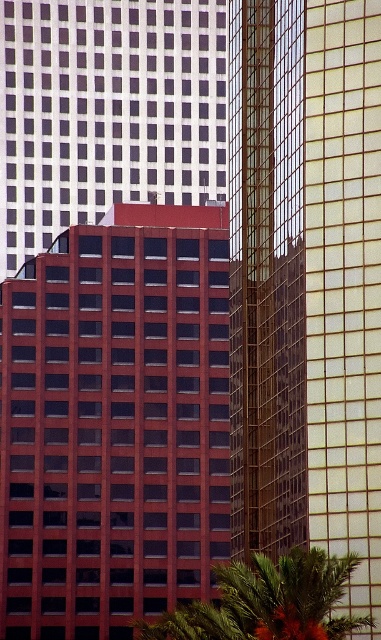
You are standing in the city and want to take a photo of the matte glass building at center. If your camera can focus on objects up to 100 meters away, will you need to move closer to get a clear shot?

The matte glass building at center is 113.96 meters away from the viewer. Since your camera can focus up to 100 meters, you need to move closer to ensure the building is within the camera range.

Consider the image. You are standing in the city and see the matte glass building at center and the green leafy tree at lower center. Which one is higher from the ground?

The matte glass building at center is above the green leafy tree at lower center, so it is higher from the ground.

You are a drone operator trying to capture a photo of the matte glass building at center. However, there is a green leafy tree at lower center in the way. Can you fly the drone above the tree to get an unobstructed view?

The green leafy tree at lower center is behind the matte glass building at center, so flying the drone above the tree would still allow you to capture the matte glass building at center without obstruction.